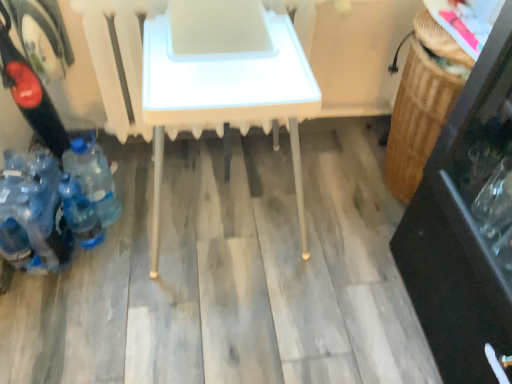
The image size is (512, 384). Describe the element at coordinates (33, 214) in the screenshot. I see `blue plastic bottles at lower left, the 3th bottle positioned from the right` at that location.

Image resolution: width=512 pixels, height=384 pixels. I want to click on blue plastic bottle at lower left, which is counted as the second bottle, starting from the left, so click(80, 213).

Between blue plastic bottle at lower left, arranged as the first bottle when viewed from the right, and white plastic table at center, which one has larger width?

Wider between the two is white plastic table at center.

From the image's perspective, is blue plastic bottle at lower left, arranged as the first bottle when viewed from the right, over white plastic table at center?

No, from the image's perspective, blue plastic bottle at lower left, arranged as the first bottle when viewed from the right, is not above white plastic table at center.

Can you tell me how much blue plastic bottle at lower left, arranged as the first bottle when viewed from the right, and white plastic table at center differ in facing direction?

0.000349 degrees separate the facing orientations of blue plastic bottle at lower left, arranged as the first bottle when viewed from the right, and white plastic table at center.

Is blue plastic bottle at lower left, the 3th bottle positioned from the left, at the left side of white plastic table at center?

Indeed, blue plastic bottle at lower left, the 3th bottle positioned from the left, is positioned on the left side of white plastic table at center.

Would you say blue plastic bottle at lower left, the 2th bottle positioned from the right, is outside blue plastic bottles at lower left, the 3th bottle positioned from the right?

Yes, blue plastic bottle at lower left, the 2th bottle positioned from the right, is located beyond the bounds of blue plastic bottles at lower left, the 3th bottle positioned from the right.

From the picture: From the image's perspective, is blue plastic bottle at lower left, the 2th bottle positioned from the right, positioned above or below blue plastic bottles at lower left, the 3th bottle positioned from the right?

blue plastic bottle at lower left, the 2th bottle positioned from the right, is situated lower than blue plastic bottles at lower left, the 3th bottle positioned from the right, in the image.

Is blue plastic bottle at lower left, the 2th bottle positioned from the right, positioned in front of blue plastic bottles at lower left, the 3th bottle positioned from the right?

No, blue plastic bottle at lower left, the 2th bottle positioned from the right, is behind blue plastic bottles at lower left, the 3th bottle positioned from the right.

Which is more to the left, blue plastic bottle at lower left, which is counted as the second bottle, starting from the left, or blue plastic bottles at lower left, the 3th bottle positioned from the right?

blue plastic bottles at lower left, the 3th bottle positioned from the right.

Between white plastic table at center and blue plastic bottles at lower left, the first bottle in the left-to-right sequence, which one is positioned in front?

white plastic table at center is in front.

From their relative heights in the image, would you say white plastic table at center is taller or shorter than blue plastic bottles at lower left, the 3th bottle positioned from the right?

In the image, white plastic table at center appears to be taller than blue plastic bottles at lower left, the 3th bottle positioned from the right.

Between white plastic table at center and blue plastic bottles at lower left, the 3th bottle positioned from the right, which one has larger size?

white plastic table at center is bigger.

Would you say white plastic table at center is outside blue plastic bottles at lower left, the first bottle in the left-to-right sequence?

Yes.

Is blue plastic bottles at lower left, the first bottle in the left-to-right sequence, outside of blue plastic bottle at lower left, which is counted as the second bottle, starting from the left?

Yes, blue plastic bottles at lower left, the first bottle in the left-to-right sequence, is not within blue plastic bottle at lower left, which is counted as the second bottle, starting from the left.

Is point (56, 212) positioned in front of point (68, 208)?

Yes, it is in front of point (68, 208).

Can you tell me how much blue plastic bottles at lower left, the first bottle in the left-to-right sequence, and blue plastic bottle at lower left, which is counted as the second bottle, starting from the left, differ in facing direction?

The angular difference between blue plastic bottles at lower left, the first bottle in the left-to-right sequence, and blue plastic bottle at lower left, which is counted as the second bottle, starting from the left, is 0.000322 degrees.

From a real-world perspective, is white plastic table at center on top of blue plastic bottle at lower left, arranged as the first bottle when viewed from the right?

Yes.

Which is behind, white plastic table at center or blue plastic bottle at lower left, arranged as the first bottle when viewed from the right?

blue plastic bottle at lower left, arranged as the first bottle when viewed from the right, is further away from the camera.

Is the surface of white plastic table at center in direct contact with blue plastic bottle at lower left, the 3th bottle positioned from the left?

They are not placed beside each other.

From the image's perspective, which one is positioned higher, white plastic table at center or blue plastic bottle at lower left, arranged as the first bottle when viewed from the right?

white plastic table at center appears higher in the image.

Based on the photo, can you confirm if blue plastic bottle at lower left, which is counted as the second bottle, starting from the left, is shorter than white plastic table at center?

Correct, blue plastic bottle at lower left, which is counted as the second bottle, starting from the left, is not as tall as white plastic table at center.

Does blue plastic bottle at lower left, which is counted as the second bottle, starting from the left, come in front of white plastic table at center?

No, the depth of blue plastic bottle at lower left, which is counted as the second bottle, starting from the left, is greater than that of white plastic table at center.

How distant is blue plastic bottle at lower left, which is counted as the second bottle, starting from the left, from white plastic table at center?

blue plastic bottle at lower left, which is counted as the second bottle, starting from the left, and white plastic table at center are 28.08 inches apart from each other.

Identify the location of table above the blue plastic bottle at lower left, the 2th bottle positioned from the right (from a real-world perspective). (229, 74).

From the image's perspective, does blue plastic bottle at lower left, the 2th bottle positioned from the right, appear lower than blue plastic bottle at lower left, arranged as the first bottle when viewed from the right?

Yes, from the image's perspective, blue plastic bottle at lower left, the 2th bottle positioned from the right, is below blue plastic bottle at lower left, arranged as the first bottle when viewed from the right.

How much distance is there between blue plastic bottle at lower left, the 2th bottle positioned from the right, and blue plastic bottle at lower left, arranged as the first bottle when viewed from the right?

blue plastic bottle at lower left, the 2th bottle positioned from the right, and blue plastic bottle at lower left, arranged as the first bottle when viewed from the right, are 4.62 inches apart.

Is blue plastic bottle at lower left, which is counted as the second bottle, starting from the left, not close to blue plastic bottle at lower left, the 3th bottle positioned from the left?

No, there isn't a large distance between blue plastic bottle at lower left, which is counted as the second bottle, starting from the left, and blue plastic bottle at lower left, the 3th bottle positioned from the left.

Is blue plastic bottle at lower left, which is counted as the second bottle, starting from the left, taller or shorter than blue plastic bottle at lower left, the 3th bottle positioned from the left?

blue plastic bottle at lower left, which is counted as the second bottle, starting from the left, is shorter than blue plastic bottle at lower left, the 3th bottle positioned from the left.

I want to click on the 3rd bottle behind the white plastic table at center, so click(x=93, y=177).

Locate an element on the screen. This screenshot has width=512, height=384. the 1st bottle to the right of the blue plastic bottles at lower left, the 3th bottle positioned from the right, counting from the anchor's position is located at coordinates (80, 213).

From the image, which object appears to be farther from blue plastic bottle at lower left, arranged as the first bottle when viewed from the right, blue plastic bottles at lower left, the first bottle in the left-to-right sequence, or white plastic table at center?

white plastic table at center is further to blue plastic bottle at lower left, arranged as the first bottle when viewed from the right.

Looking at this image, from the image, which object appears to be farther from blue plastic bottle at lower left, the 2th bottle positioned from the right, white plastic table at center or blue plastic bottle at lower left, arranged as the first bottle when viewed from the right?

white plastic table at center is positioned further to the anchor blue plastic bottle at lower left, the 2th bottle positioned from the right.

Looking at the image, which one is located further to white plastic table at center, blue plastic bottle at lower left, which is counted as the second bottle, starting from the left, or blue plastic bottle at lower left, arranged as the first bottle when viewed from the right?

blue plastic bottle at lower left, which is counted as the second bottle, starting from the left, lies further to white plastic table at center than the other object.

Which object lies nearer to the anchor point blue plastic bottles at lower left, the first bottle in the left-to-right sequence, blue plastic bottle at lower left, the 3th bottle positioned from the left, or blue plastic bottle at lower left, which is counted as the second bottle, starting from the left?

Among the two, blue plastic bottle at lower left, which is counted as the second bottle, starting from the left, is located nearer to blue plastic bottles at lower left, the first bottle in the left-to-right sequence.

When comparing their distances from blue plastic bottle at lower left, the 3th bottle positioned from the left, does blue plastic bottle at lower left, which is counted as the second bottle, starting from the left, or blue plastic bottles at lower left, the 3th bottle positioned from the right, seem closer?

blue plastic bottle at lower left, which is counted as the second bottle, starting from the left, is positioned closer to the anchor blue plastic bottle at lower left, the 3th bottle positioned from the left.

Based on their spatial positions, is blue plastic bottles at lower left, the 3th bottle positioned from the right, or blue plastic bottle at lower left, the 3th bottle positioned from the left, further from white plastic table at center?

blue plastic bottle at lower left, the 3th bottle positioned from the left, is positioned further to the anchor white plastic table at center.

Considering their positions, is blue plastic bottle at lower left, arranged as the first bottle when viewed from the right, positioned closer to blue plastic bottles at lower left, the 3th bottle positioned from the right, than white plastic table at center?

blue plastic bottle at lower left, arranged as the first bottle when viewed from the right, is positioned closer to the anchor blue plastic bottles at lower left, the 3th bottle positioned from the right.

Looking at this image, which object lies nearer to the anchor point blue plastic bottle at lower left, the 2th bottle positioned from the right, blue plastic bottles at lower left, the 3th bottle positioned from the right, or blue plastic bottle at lower left, the 3th bottle positioned from the left?

blue plastic bottles at lower left, the 3th bottle positioned from the right, is positioned closer to the anchor blue plastic bottle at lower left, the 2th bottle positioned from the right.

The height and width of the screenshot is (384, 512). Find the location of `bottle between blue plastic bottles at lower left, the first bottle in the left-to-right sequence, and blue plastic bottle at lower left, the 3th bottle positioned from the left, in the horizontal direction`. bottle between blue plastic bottles at lower left, the first bottle in the left-to-right sequence, and blue plastic bottle at lower left, the 3th bottle positioned from the left, in the horizontal direction is located at coordinates (80, 213).